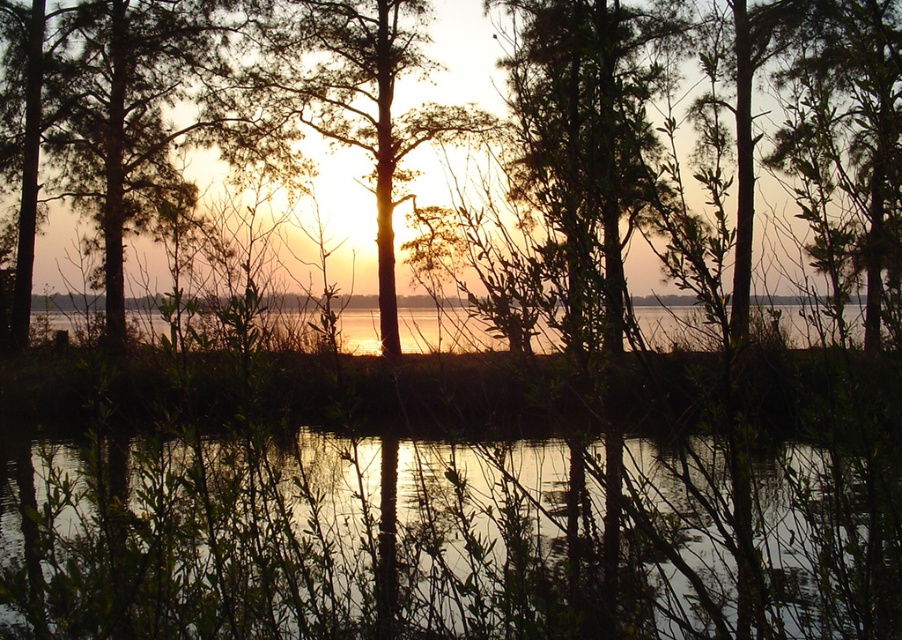
Based on the photo, you are standing at the point with coordinates point (x=456, y=132) and want to walk towards the point (x=612, y=170). Since both points are in the image, which direction should you move in to get closer to your destination?

You should move away from the camera because point (x=612, y=170) is closer to the camera than point (x=456, y=132). Moving away from the camera will take you towards the point that is nearer in the scene.

You are an artist trying to paint the sunset scene. You notice the transparent water at center and the green leafy tree at center. Which object should you paint first if you want to follow the rule of painting smaller objects before larger ones?

The transparent water at center should be painted first because it has a smaller size compared to the green leafy tree at center.

You are a bird flying over the wetland and want to land on the silhouette bark tree at center. However, you notice the transparent water at center is in your flight path. Based on the scene description, can you safely land on the tree without hitting the water?

The transparent water at center is taller than the silhouette bark tree at center, meaning the water is higher in elevation. Since the tree is shorter than the water, the bird can safely descend towards the tree without hitting the water as it is below the water level.